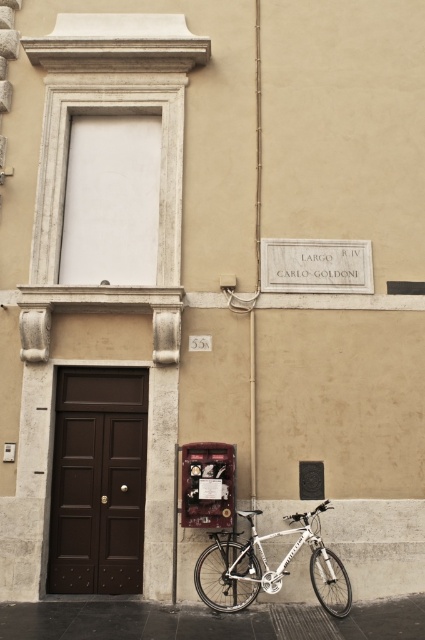
Does brown wooden door at center appear on the right side of metallic red phone box at lower center?

In fact, brown wooden door at center is to the left of metallic red phone box at lower center.

Does brown wooden door at center have a lesser height compared to metallic red phone box at lower center?

Incorrect, brown wooden door at center's height does not fall short of metallic red phone box at lower center's.

Is point (65, 472) closer to camera compared to point (189, 506)?

No, (65, 472) is behind (189, 506).

Locate an element on the screen. The image size is (425, 640). brown wooden door at center is located at coordinates (98, 481).

Does silver metallic bicycle at lower center appear on the right side of metallic red phone box at lower center?

Correct, you'll find silver metallic bicycle at lower center to the right of metallic red phone box at lower center.

Does silver metallic bicycle at lower center appear over metallic red phone box at lower center?

Incorrect, silver metallic bicycle at lower center is not positioned above metallic red phone box at lower center.

Is point (212, 547) farther from camera compared to point (193, 522)?

Yes, it is behind point (193, 522).

Identify the location of silver metallic bicycle at lower center. The width and height of the screenshot is (425, 640). (269, 566).

Between brown wooden door at center and silver metallic bicycle at lower center, which one is positioned lower?

silver metallic bicycle at lower center

Does brown wooden door at center appear on the right side of silver metallic bicycle at lower center?

Incorrect, brown wooden door at center is not on the right side of silver metallic bicycle at lower center.

Is point (105, 380) more distant than point (325, 570)?

Yes, point (105, 380) is farther from viewer.

Identify the location of brown wooden door at center. This screenshot has width=425, height=640. (98, 481).